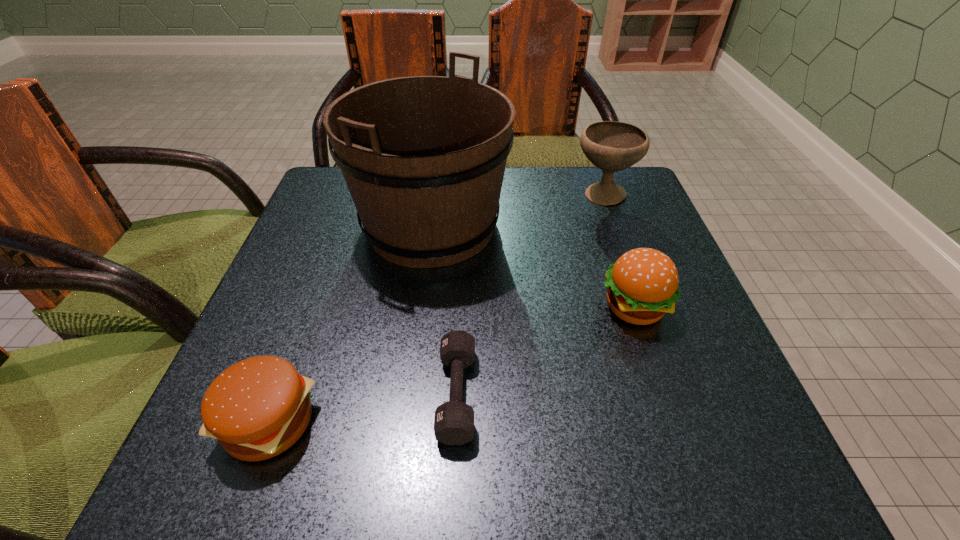
This screenshot has height=540, width=960. Find the location of `free space that is in between the taller hamburger and the fourth shortest object`. free space that is in between the taller hamburger and the fourth shortest object is located at coordinates (617, 252).

The image size is (960, 540). Find the location of `empty location between the dumbbell and the taller hamburger`. empty location between the dumbbell and the taller hamburger is located at coordinates tap(544, 350).

Image resolution: width=960 pixels, height=540 pixels. In order to click on blank region between the shortest object and the chalice in this screenshot , I will do `click(530, 295)`.

This screenshot has height=540, width=960. In order to click on vacant area between the second tallest object and the tallest object in this screenshot , I will do `click(516, 211)`.

Locate an element on the screen. This screenshot has height=540, width=960. free space between the dumbbell and the farther hamburger is located at coordinates (544, 350).

Identify the location of blank region between the left hamburger and the dumbbell. This screenshot has height=540, width=960. (363, 408).

I want to click on free space between the shortest object and the fourth shortest object, so click(x=530, y=295).

This screenshot has width=960, height=540. Find the location of `free space between the tallest object and the fourth tallest object`. free space between the tallest object and the fourth tallest object is located at coordinates (350, 324).

The width and height of the screenshot is (960, 540). I want to click on free space between the third tallest object and the bucket, so click(532, 266).

Select which object is the fourth closest to the tallest object. Please provide its 2D coordinates. Your answer should be formatted as a tuple, i.e. [(x, y)], where the tuple contains the x and y coordinates of a point satisfying the conditions above.

[(257, 408)]